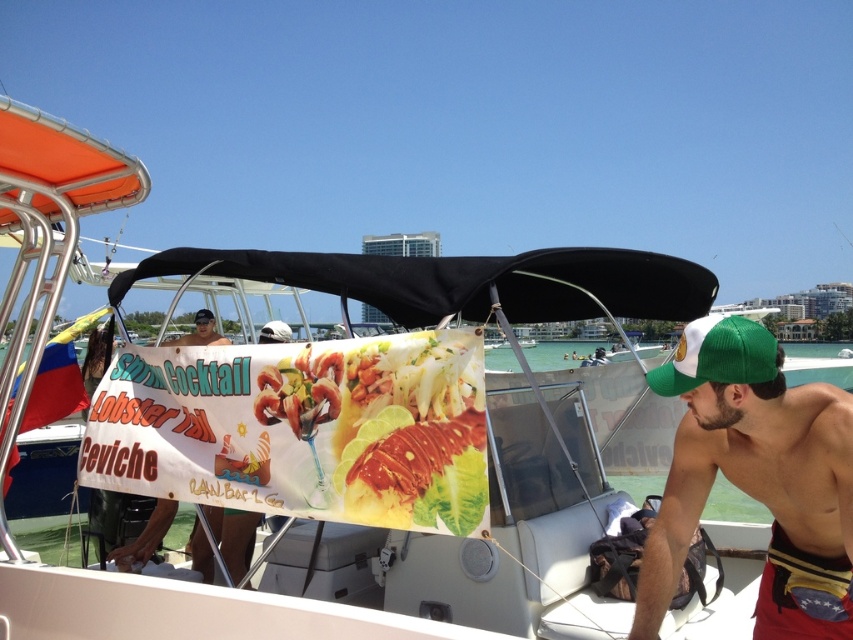
Question: In this image, where is green fabric baseball cap at right located relative to matte black signboard at center?

Choices:
 (A) right
 (B) left

Answer: (A)

Question: Considering the real-world distances, which object is farthest from the green fabric cap at right?

Choices:
 (A) green fabric baseball cap at right
 (B) shiny lobster at center

Answer: (B)

Question: Can you confirm if green fabric cap at right is bigger than shiny lobster at center?

Choices:
 (A) no
 (B) yes

Answer: (B)

Question: Estimate the real-world distances between objects in this image. Which object is farther from the shiny lobster at center?

Choices:
 (A) green fabric cap at right
 (B) green fabric baseball cap at right
 (C) matte black signboard at center

Answer: (C)

Question: Is shiny lobster at center wider than matte black signboard at center?

Choices:
 (A) yes
 (B) no

Answer: (A)

Question: Which object is farther from the camera taking this photo?

Choices:
 (A) shiny lobster at center
 (B) green fabric baseball cap at right

Answer: (A)